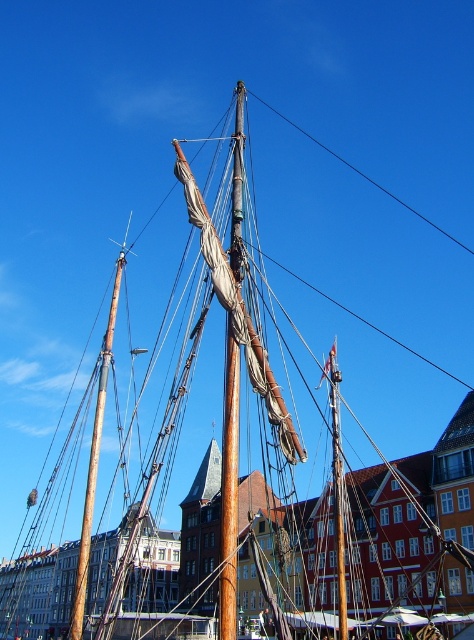
Question: Which point is closer to the camera taking this photo?

Choices:
 (A) (227, 618)
 (B) (115, 301)

Answer: (A)

Question: Is wooden mast at center below brown wood mast at upper center?

Choices:
 (A) yes
 (B) no

Answer: (A)

Question: Is wooden mast at center bigger than brown wood mast at upper center?

Choices:
 (A) no
 (B) yes

Answer: (A)

Question: Which point is closer to the camera?

Choices:
 (A) wooden mast at center
 (B) brown wood mast at upper center

Answer: (A)

Question: Is wooden mast at center further to camera compared to brown wood mast at upper center?

Choices:
 (A) no
 (B) yes

Answer: (A)